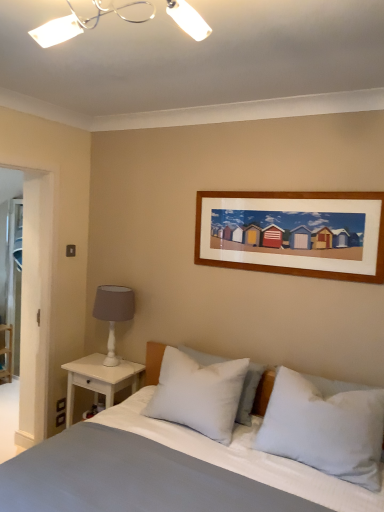
Locate an element on the screen. The height and width of the screenshot is (512, 384). free location above white matte table lamp at left (from a real-world perspective) is located at coordinates (112, 288).